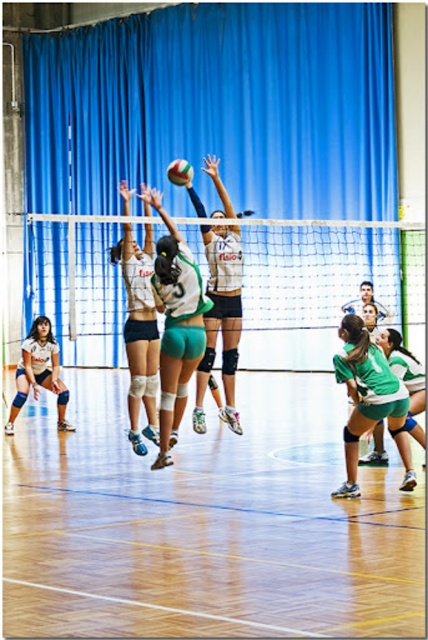
You are a volleyball player positioned at the back of the court and want to hit the ball over the white mesh net at center. The green jersey at center is blocking your path. Which object is closer to you so you can adjust your shot?

The green jersey at center is closer to you than the white mesh net at center, so you should aim your shot above the green jersey at center to clear the white mesh net at center.

Consider the image. You are a photographer positioned at the camera location. You want to capture a closeup shot of the volleyball game. The point of interest is at point (255, 284). Given that your camera can focus on objects within 20 meters, will you be able to focus on that point?

The distance of point (255, 284) from the camera is 25.58 meters, which is beyond the camera focus range of 20 meters. Therefore, the camera cannot focus on that point.